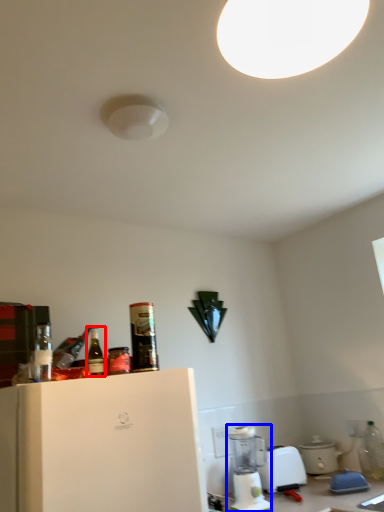
Question: Among these objects, which one is farthest to the camera, bottle (highlighted by a red box) or blender (highlighted by a blue box)?

Choices:
 (A) bottle
 (B) blender

Answer: (B)